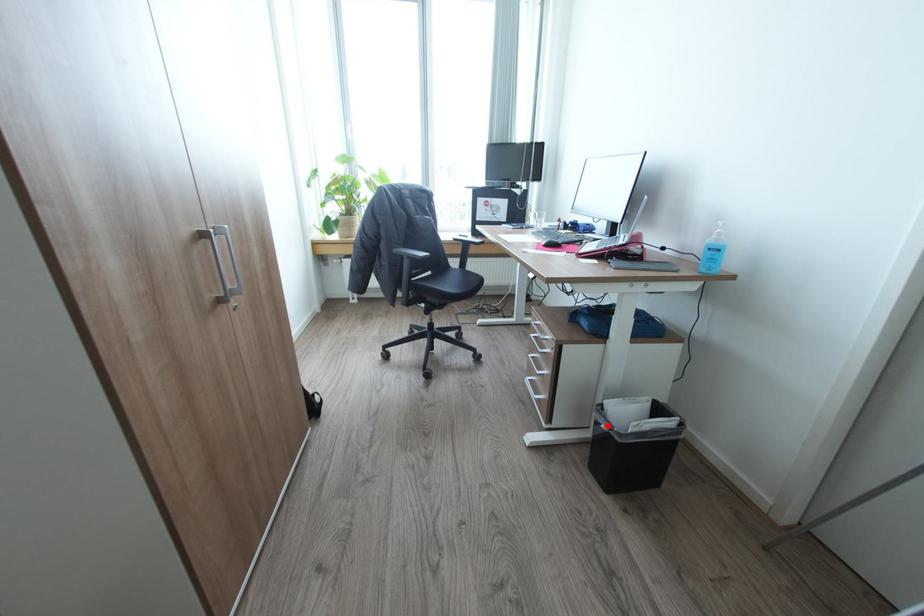
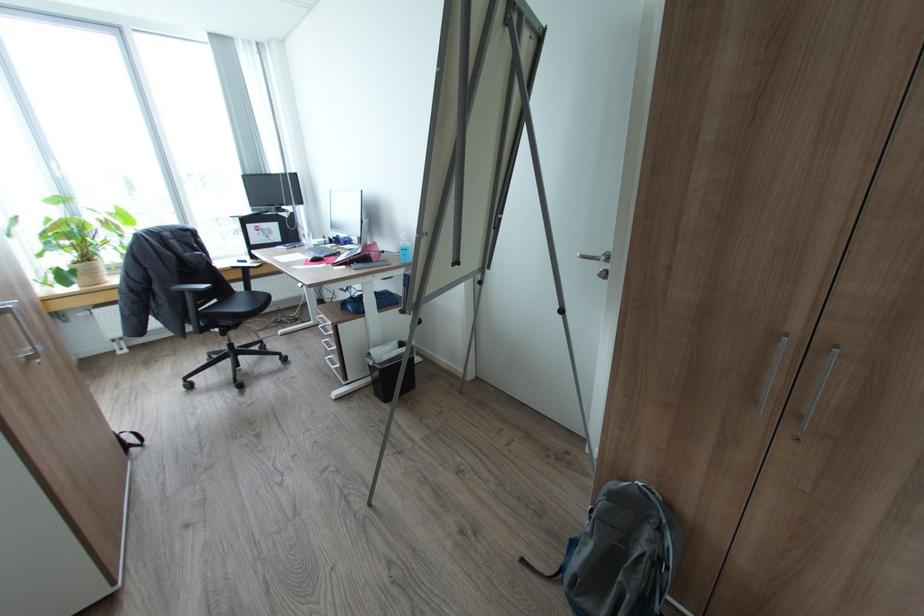
Question: I am providing you with two images of the same scene from different viewpoints. Image1 has a red point marked. In image2, the corresponding 3D location appears at what relative position? Reply with the corresponding letter.

Choices:
 (A) Closer
 (B) Farther

Answer: (B)